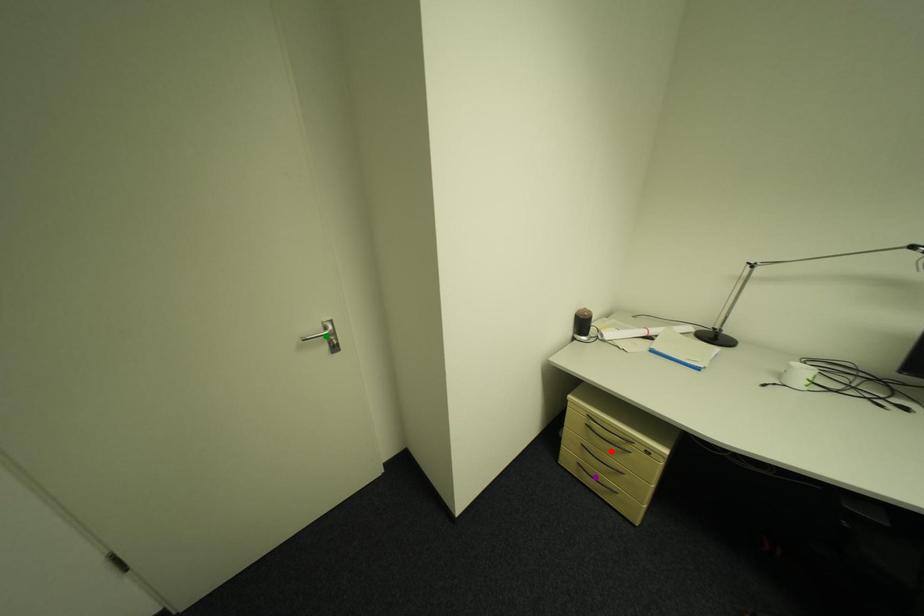
Order these from nearest to farthest:
A) green point
B) red point
C) purple point

green point, red point, purple point